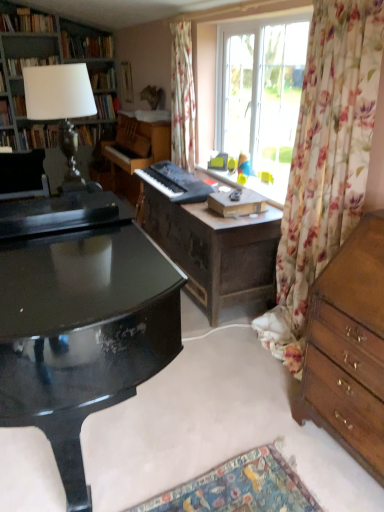
Question: Considering the positions of point (129, 96) and point (152, 145), is point (129, 96) closer or farther from the camera than point (152, 145)?

Choices:
 (A) closer
 (B) farther

Answer: (B)

Question: Considering the relative positions of hardcover book at upper center, acting as the fifth book starting from the top, and wooden piano at center, the second piano from the front, in the image provided, is hardcover book at upper center, acting as the fifth book starting from the top, to the left or to the right of wooden piano at center, the second piano from the front,?

Choices:
 (A) right
 (B) left

Answer: (B)

Question: Which object is positioned farthest from the wooden vanity at center?

Choices:
 (A) floral fabric curtain at right, placed as the 2th curtain when sorted from left to right
 (B) white paper at upper left, which appears as the 5th book when ordered from the bottom
 (C) black matte keyboard at center, marked as the 2th piano in a back-to-front arrangement
 (D) hardcover book at left, the 7th book when ordered from top to bottom
 (E) matte black lampshade at upper left, marked as the 4th book in a top-to-bottom arrangement

Answer: (E)

Question: Which of these objects is positioned farthest from the silver metallic lamp at upper left?

Choices:
 (A) glossy wood desk at center
 (B) hardcover books at upper left, the 2th book in the top-to-bottom sequence
 (C) floral fabric curtain at right, positioned as the first curtain in right-to-left order
 (D) floral fabric curtain at upper center, which is the first curtain in back-to-front order
 (E) hardcover book at upper left, the 7th book ordered from the bottom

Answer: (C)